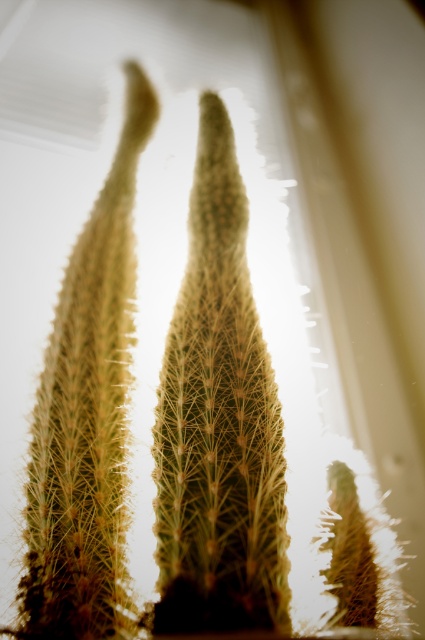
Which is more to the right, green spiky cactus at center or green spiky cactus at left?

From the viewer's perspective, green spiky cactus at center appears more on the right side.

Who is higher up, green spiky cactus at center or green spiky cactus at left?

green spiky cactus at left is higher up.

Based on the photo, who is more forward, (223, 172) or (57, 625)?

Point (57, 625)

Identify the location of green spiky cactus at center. (218, 422).